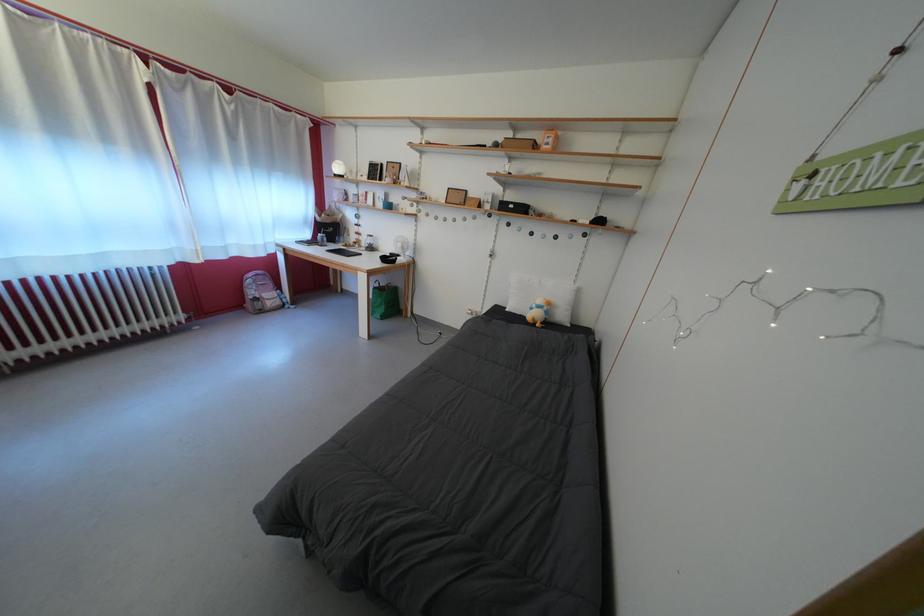
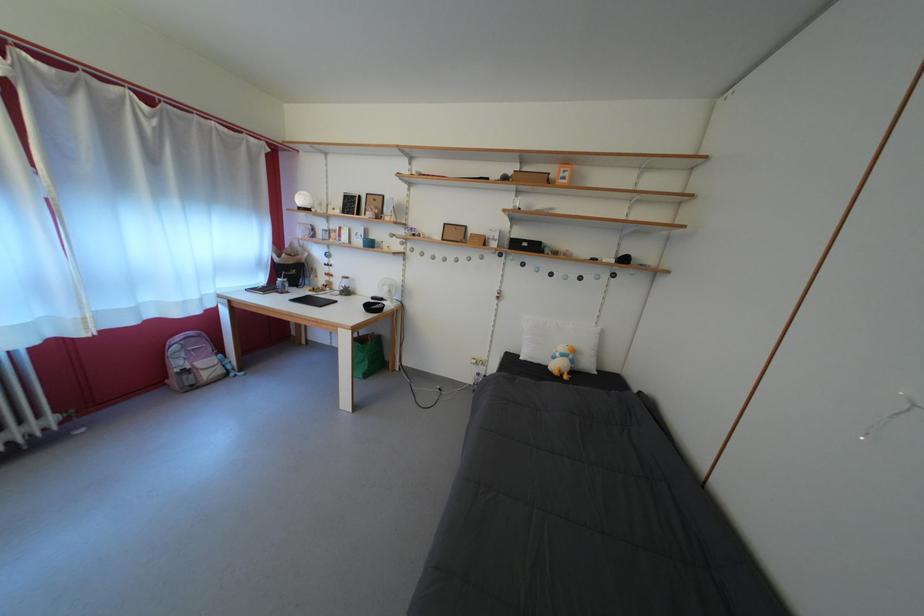
In a continuous first-person perspective shot, in which direction is the camera moving?

The cameraman walked toward left, forward.